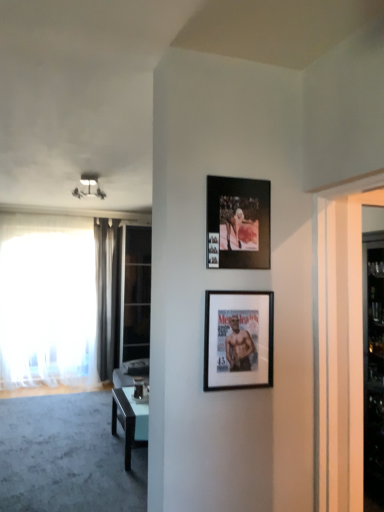
Question: In the image, is transparent glass door at left positioned in front of or behind black matte picture frame at center, placed as the 1th picture frame when sorted from bottom to top?

Choices:
 (A) behind
 (B) front

Answer: (A)

Question: Choose the correct answer: Is transparent glass door at left inside black matte picture frame at center, placed as the 1th picture frame when sorted from bottom to top, or outside it?

Choices:
 (A) inside
 (B) outside

Answer: (B)

Question: Considering the real-world distances, which object is farthest from the matte white light fixture at upper left?

Choices:
 (A) white glass door at right
 (B) silky gray curtain at left, which is counted as the 1th curtain, starting from the right
 (C) white sheer curtain at left, the first curtain in the left-to-right sequence
 (D) black matte picture frame at center, placed as the 1th picture frame when sorted from bottom to top
 (E) transparent glass door at left

Answer: (A)

Question: Considering the real-world distances, which object is closest to the silky gray curtain at left, which is counted as the 1th curtain, starting from the right?

Choices:
 (A) matte white light fixture at upper left
 (B) black matte picture frame at center, placed as the 1th picture frame when sorted from bottom to top
 (C) white glass door at right
 (D) light blue glossy table at center
 (E) black matte picture frame at upper center, which appears as the 2th picture frame when ordered from the bottom

Answer: (A)